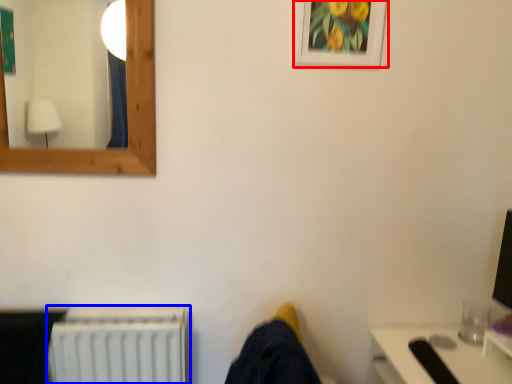
Question: Which of the following is the farthest to the observer, picture frame (highlighted by a red box) or radiator (highlighted by a blue box)?

Choices:
 (A) picture frame
 (B) radiator

Answer: (B)